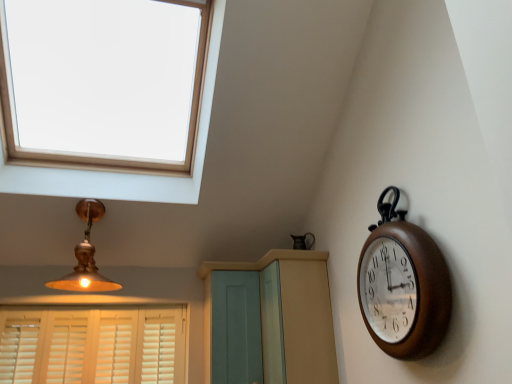
Describe the element at coordinates (234, 328) in the screenshot. The height and width of the screenshot is (384, 512). I see `light blue wood screen door at center` at that location.

Measure the distance between light blue wood dresser at center and camera.

7.04 feet.

This screenshot has width=512, height=384. I want to click on brown wooden clock at right, so click(403, 285).

From a real-world perspective, does light blue wood screen door at center stand above light blue wood dresser at center?

No, from a real-world perspective, light blue wood screen door at center is not over light blue wood dresser at center

From the image's perspective, which object appears higher, light blue wood screen door at center or light blue wood dresser at center?

From the image's view, light blue wood dresser at center is above.

Could light blue wood dresser at center be considered to be inside light blue wood screen door at center?

Actually, light blue wood dresser at center is outside light blue wood screen door at center.

Is light blue wood screen door at center directly adjacent to light blue wood dresser at center?

There is a gap between light blue wood screen door at center and light blue wood dresser at center.

In the scene shown: Is the depth of brown wooden clock at right less than that of white wood blinds at lower left?

Yes, brown wooden clock at right is in front of white wood blinds at lower left.

Is brown wooden clock at right oriented away from white wood blinds at lower left?

No, brown wooden clock at right is not facing the opposite direction of white wood blinds at lower left.

Considering the sizes of objects brown wooden clock at right and white wood blinds at lower left in the image provided, who is smaller, brown wooden clock at right or white wood blinds at lower left?

brown wooden clock at right is smaller.

Is brown wooden clock at right next to white wood blinds at lower left and touching it?

brown wooden clock at right and white wood blinds at lower left are not in contact.

Are light blue wood dresser at center and matte gold lampshade at upper left far apart?

Yes.

Can we say light blue wood dresser at center lies outside matte gold lampshade at upper left?

light blue wood dresser at center lies outside matte gold lampshade at upper left's area.

Looking at this image, is white wood blinds at lower left thinner than brown wooden clock at right?

Indeed, white wood blinds at lower left has a lesser width compared to brown wooden clock at right.

Where is `wall clock above the white wood blinds at lower left (from a real-world perspective)`? wall clock above the white wood blinds at lower left (from a real-world perspective) is located at coordinates (403, 285).

Which is nearer, [126,321] or [415,285]?

The point [415,285] is closer.

Could you tell me if matte gold lampshade at upper left is facing light blue wood dresser at center?

No, matte gold lampshade at upper left is not facing towards light blue wood dresser at center.

Can you tell me how much matte gold lampshade at upper left and light blue wood dresser at center differ in facing direction?

89.7 degrees.

Considering their positions, is matte gold lampshade at upper left located in front of or behind light blue wood dresser at center?

matte gold lampshade at upper left is positioned farther from the viewer than light blue wood dresser at center.

Where is `lamp that is above the light blue wood dresser at center (from the image's perspective)`? The width and height of the screenshot is (512, 384). lamp that is above the light blue wood dresser at center (from the image's perspective) is located at coordinates (86, 256).

Would you say light blue wood dresser at center is a long distance from white wood blinds at lower left?

Absolutely, light blue wood dresser at center is distant from white wood blinds at lower left.

From a real-world perspective, which object rests below the other?

white wood blinds at lower left, from a real-world perspective.

Based on their positions, is light blue wood dresser at center located to the left or right of white wood blinds at lower left?

Based on their positions, light blue wood dresser at center is located to the right of white wood blinds at lower left.

Are brown wooden clock at right and matte gold lampshade at upper left located far from each other?

brown wooden clock at right is positioned a significant distance from matte gold lampshade at upper left.

From a real-world perspective, is brown wooden clock at right below matte gold lampshade at upper left?

Correct, in the physical world, brown wooden clock at right is lower than matte gold lampshade at upper left.

Is brown wooden clock at right aimed at matte gold lampshade at upper left?

No, brown wooden clock at right does not turn towards matte gold lampshade at upper left.

Is brown wooden clock at right not within matte gold lampshade at upper left?

That's correct, brown wooden clock at right is outside of matte gold lampshade at upper left.

Locate an element on the screen. This screenshot has width=512, height=384. screen door behind the light blue wood dresser at center is located at coordinates (234, 328).

The height and width of the screenshot is (384, 512). In the image, there is a white wood blinds at lower left. What are the coordinates of `wall clock above it (from the image's perspective)` in the screenshot? It's located at (403, 285).

From the image, which object appears to be farther from light blue wood screen door at center, light blue wood dresser at center or brown wooden clock at right?

brown wooden clock at right lies further to light blue wood screen door at center than the other object.

Considering their positions, is light blue wood screen door at center positioned further to matte gold lampshade at upper left than light blue wood dresser at center?

Among the two, light blue wood dresser at center is located further to matte gold lampshade at upper left.

Estimate the real-world distances between objects in this image. Which object is further from light blue wood dresser at center, brown wooden clock at right or matte gold lampshade at upper left?

Based on the image, matte gold lampshade at upper left appears to be further to light blue wood dresser at center.

Estimate the real-world distances between objects in this image. Which object is further from light blue wood dresser at center, matte gold lampshade at upper left or white wood blinds at lower left?

matte gold lampshade at upper left is positioned further to the anchor light blue wood dresser at center.

From the image, which object appears to be farther from brown wooden clock at right, light blue wood dresser at center or light blue wood screen door at center?

light blue wood screen door at center is further to brown wooden clock at right.

Looking at this image, looking at the image, which one is located closer to light blue wood dresser at center, white wood blinds at lower left or brown wooden clock at right?

brown wooden clock at right.

Looking at the image, which one is located further to light blue wood screen door at center, brown wooden clock at right or white wood blinds at lower left?

brown wooden clock at right is positioned further to the anchor light blue wood screen door at center.

Which object lies nearer to the anchor point light blue wood dresser at center, light blue wood screen door at center or matte gold lampshade at upper left?

The object closer to light blue wood dresser at center is light blue wood screen door at center.

Where is `lamp located between white wood blinds at lower left and light blue wood screen door at center in the left-right direction`? The height and width of the screenshot is (384, 512). lamp located between white wood blinds at lower left and light blue wood screen door at center in the left-right direction is located at coordinates (86, 256).

Image resolution: width=512 pixels, height=384 pixels. I want to click on screen door between matte gold lampshade at upper left and light blue wood dresser at center from left to right, so click(x=234, y=328).

You are a GUI agent. You are given a task and a screenshot of the screen. Output one action in this format:
    pyautogui.click(x=<x>, y=<y>)
    Task: Click on the dresser located between brown wooden clock at right and light blue wood screen door at center in the depth direction
    The height and width of the screenshot is (384, 512).
    Given the screenshot: What is the action you would take?
    pyautogui.click(x=284, y=316)

At what (x,y) coordinates should I click in order to perform the action: click on screen door between matte gold lampshade at upper left and brown wooden clock at right in the horizontal direction. Please return your answer as a coordinate pair (x, y). The image size is (512, 384). Looking at the image, I should click on (x=234, y=328).